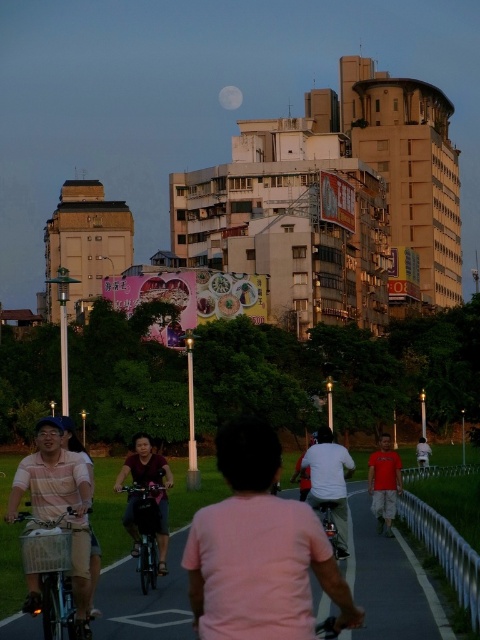
Measure the distance between white matte shirt at center and camera.

52.99 meters

Is white matte shirt at center taller than shiny metallic bicycle at center?

Indeed, white matte shirt at center has a greater height compared to shiny metallic bicycle at center.

The image size is (480, 640). What do you see at coordinates (328, 481) in the screenshot? I see `white matte shirt at center` at bounding box center [328, 481].

At what (x,y) coordinates should I click in order to perform the action: click on white matte shirt at center. Please return your answer as a coordinate pair (x, y). Looking at the image, I should click on (328, 481).

Who is positioned more to the right, silver metallic bicycle at center-left or red cotton shirt at center?

From the viewer's perspective, red cotton shirt at center appears more on the right side.

Consider the image. Which is more to the left, silver metallic bicycle at center-left or red cotton shirt at center?

silver metallic bicycle at center-left

You are a GUI agent. You are given a task and a screenshot of the screen. Output one action in this format:
    pyautogui.click(x=<x>, y=<y>)
    Task: Click on the silver metallic bicycle at center-left
    The height and width of the screenshot is (640, 480).
    Given the screenshot: What is the action you would take?
    pyautogui.click(x=52, y=576)

Where is `silver metallic bicycle at center-left`? This screenshot has width=480, height=640. silver metallic bicycle at center-left is located at coordinates (52, 576).

Is shiny black bicycle at center smaller than white matte moon at upper center?

Correct, shiny black bicycle at center occupies less space than white matte moon at upper center.

In order to click on shiny black bicycle at center in this screenshot , I will do `click(146, 529)`.